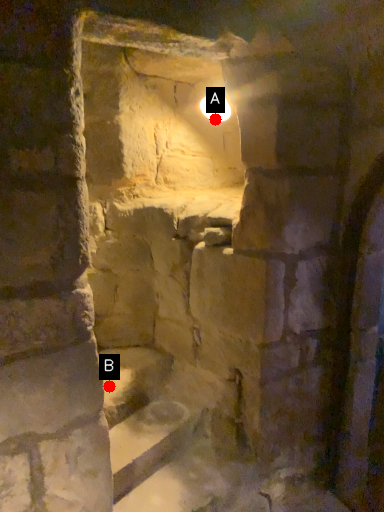
Question: Two points are circled on the image, labeled by A and B beside each circle. Which of the following is the farthest from the observer?

Choices:
 (A) A is further
 (B) B is further

Answer: (A)